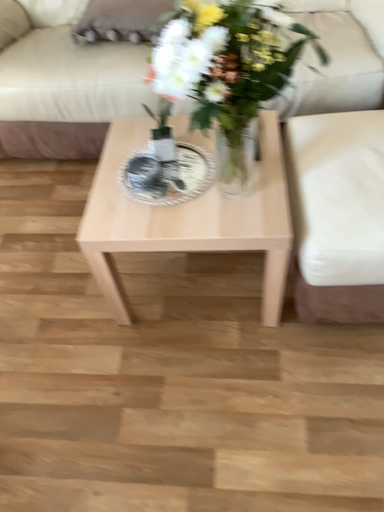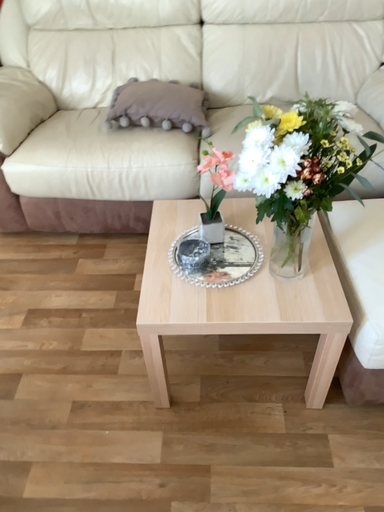
Question: How did the camera likely rotate when shooting the video?

Choices:
 (A) rotated upward
 (B) rotated downward

Answer: (A)